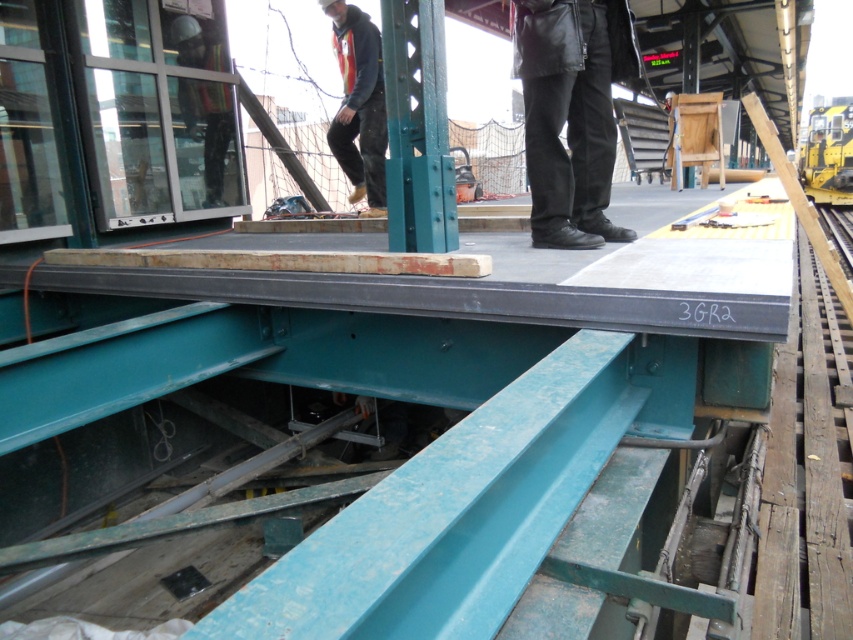
Which is above, black leather pants at center or reflective safety vest at upper center?

reflective safety vest at upper center is higher up.

From the picture: Can you confirm if black leather pants at center is shorter than reflective safety vest at upper center?

Yes.

Is point (573, 124) positioned before point (344, 33)?

Yes.

At what (x,y) coordinates should I click in order to perform the action: click on black leather pants at center. Please return your answer as a coordinate pair (x, y). The image size is (853, 640). Looking at the image, I should click on (566, 120).